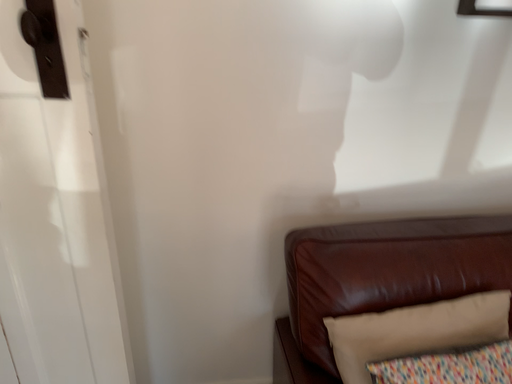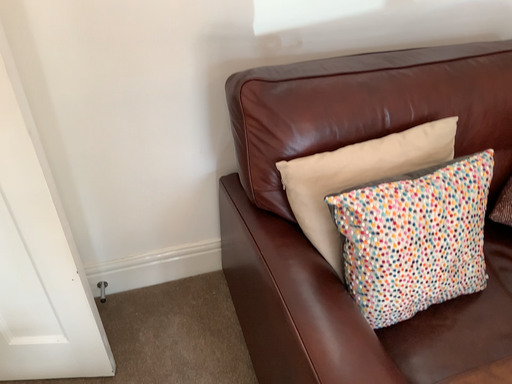
Question: Which way did the camera rotate in the video?

Choices:
 (A) rotated downward
 (B) rotated upward

Answer: (A)